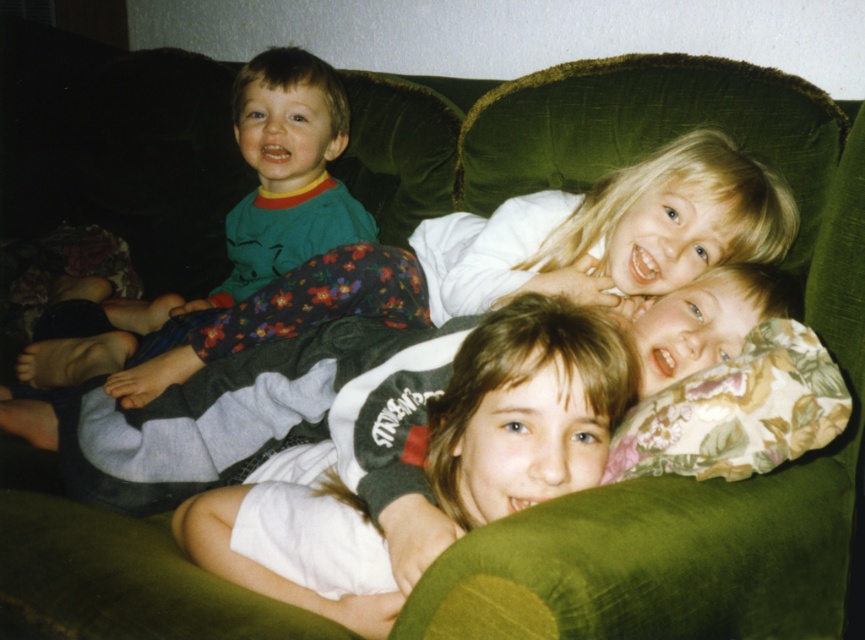
You are a photographer standing at the center of the room. You want to take a photo of the green soft pajamas at left. Where should you aim your camera to capture it in the frame?

You should aim your camera at point (274, 184) to capture the green soft pajamas at left in the frame.

You are standing in the room and want to reach the point marked at coordinates (601,216). If your maximum reach is 1.2 meters, can you extend your arm to touch that point?

The point at coordinates (601,216) is 1.33 meters away from the camera, which is beyond your 1.2 meter reach. You cannot touch it with your arm.